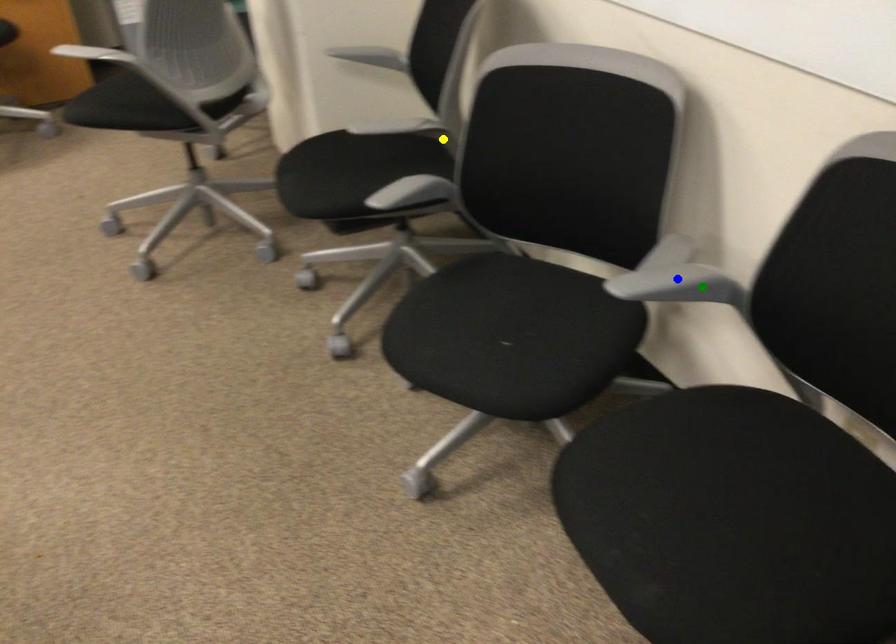
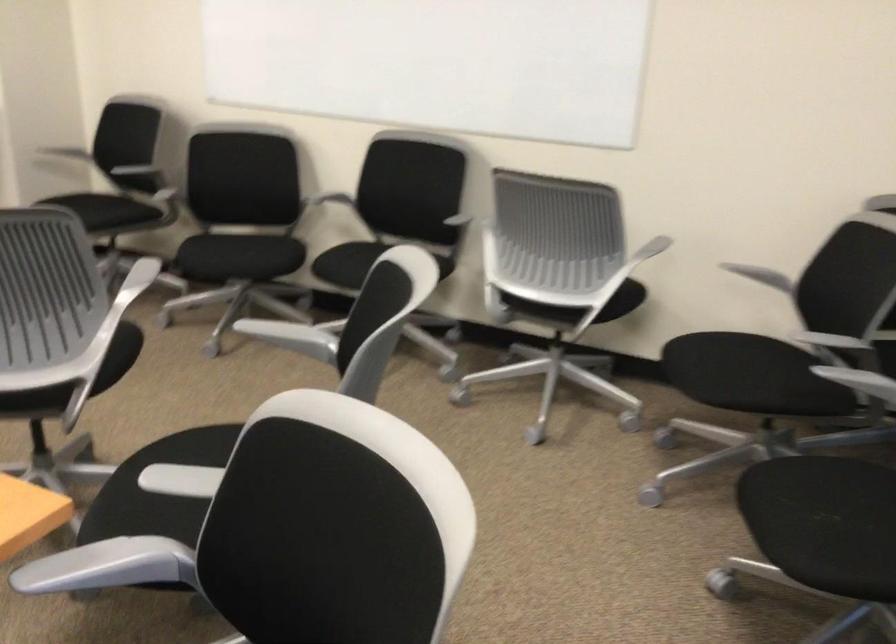
I am providing you with two images of the same scene from different viewpoints. Three points are marked in image1. Which point corresponds to a part or object that is occluded in image2?In image1, three points are marked. Which of them correspond to a part or object that is occluded in image2?Among the three points shown in image1, which one corresponds to a part or object that is no longer visible due to occlusion in image2?

blue point